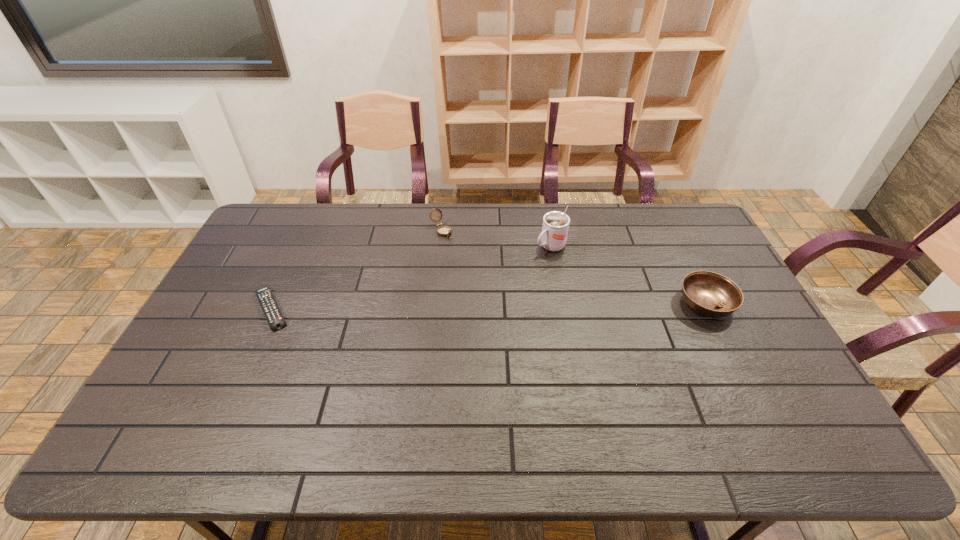
At what (x,y) coordinates should I click in order to perform the action: click on remote control. Please return your answer as a coordinate pair (x, y). Looking at the image, I should click on (271, 310).

Image resolution: width=960 pixels, height=540 pixels. I want to click on the leftmost object, so click(x=271, y=310).

The height and width of the screenshot is (540, 960). I want to click on the rightmost object, so click(x=710, y=294).

Where is `the second object from left to right`? The height and width of the screenshot is (540, 960). the second object from left to right is located at coordinates (444, 231).

This screenshot has height=540, width=960. Find the location of `the second object from right to left`. the second object from right to left is located at coordinates (555, 227).

Where is `the tallest object`? the tallest object is located at coordinates (555, 227).

The image size is (960, 540). Find the location of `free space located on the back of the remote control`. free space located on the back of the remote control is located at coordinates (287, 273).

Where is `free space located on the back of the soup bowl`? This screenshot has width=960, height=540. free space located on the back of the soup bowl is located at coordinates (671, 234).

Locate an element on the screen. This screenshot has width=960, height=540. vacant area situated 0.340m on the face of the compass is located at coordinates (501, 296).

This screenshot has height=540, width=960. In order to click on free location located 0.130m on the face of the compass in this screenshot , I will do `click(467, 259)`.